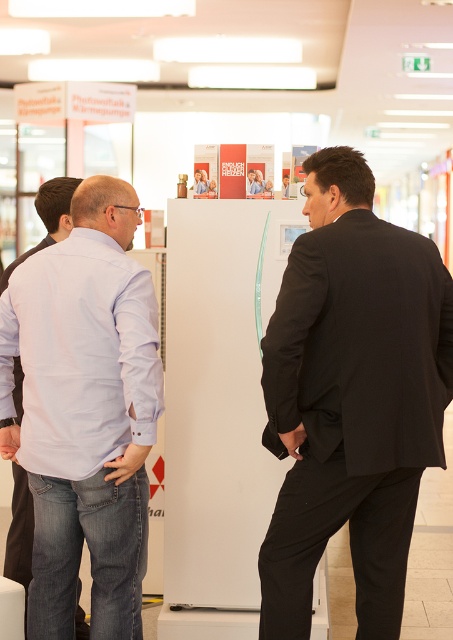
Looking at this image, in the scene described, where is the black suit at center located in terms of coordinates?

The black suit at center is located at point coordinates of (351, 397).